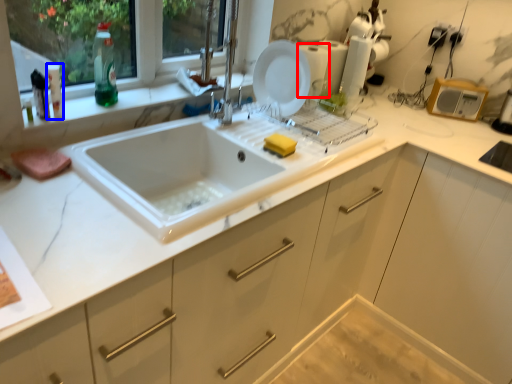
Question: Which object is further to the camera taking this photo, appliance (highlighted by a red box) or bottle (highlighted by a blue box)?

Choices:
 (A) appliance
 (B) bottle

Answer: (A)